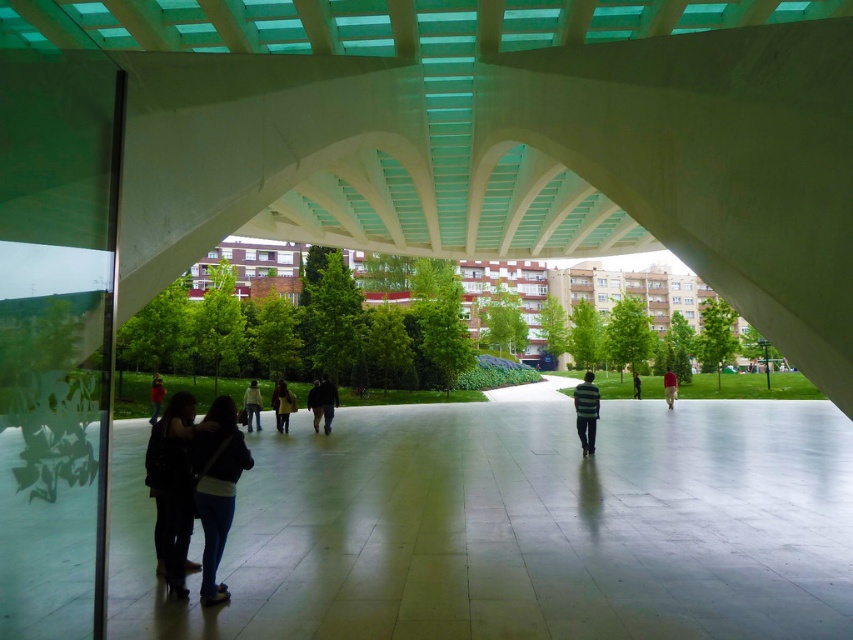
You are standing in the architectural space and see the denim jacket at lower left and the tan fabric pants at center. Which object is positioned farther to the left?

The denim jacket at lower left is positioned to the left of the tan fabric pants at center, so it is farther to the left.

Consider the image. You are standing at the point with coordinates (218, 490) in the image. What object are you currently standing on?

You are standing on the denim jacket at lower left.